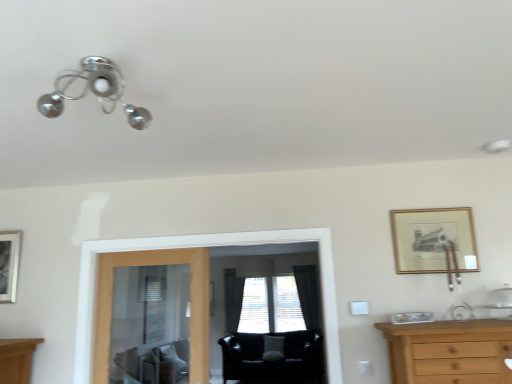
Question: Based on their sizes in the image, would you say black fabric curtain at center, arranged as the second curtain when viewed from the left, is bigger or smaller than gold wooden picture frame at upper right, which is counted as the 1th picture frame, starting from the right?

Choices:
 (A) big
 (B) small

Answer: (A)

Question: Relative to gold wooden picture frame at upper right, positioned as the 2th picture frame in back-to-front order, is black fabric curtain at center, the first curtain positioned from the right, in front or behind?

Choices:
 (A) front
 (B) behind

Answer: (B)

Question: Which of these objects is positioned closest to the black fabric curtain at center, which is counted as the 1th curtain, starting from the left?

Choices:
 (A) gold wooden picture frame at upper right, positioned as the 2th picture frame in back-to-front order
 (B) black fabric curtain at center, the first curtain positioned from the right
 (C) clear glass door at center
 (D) black leather swivel chair at center
 (E) transparent glass screen door at center

Answer: (D)

Question: Estimate the real-world distances between objects in this image. Which object is closer to the gold wooden picture frame at upper right, the second picture frame when ordered from left to right?

Choices:
 (A) transparent glass screen door at center
 (B) gray fabric window at center
 (C) black fabric curtain at center, arranged as the second curtain when viewed from the left
 (D) silver metallic picture frame at left, which is the 2th picture frame in front-to-back order
 (E) black leather swivel chair at center

Answer: (A)